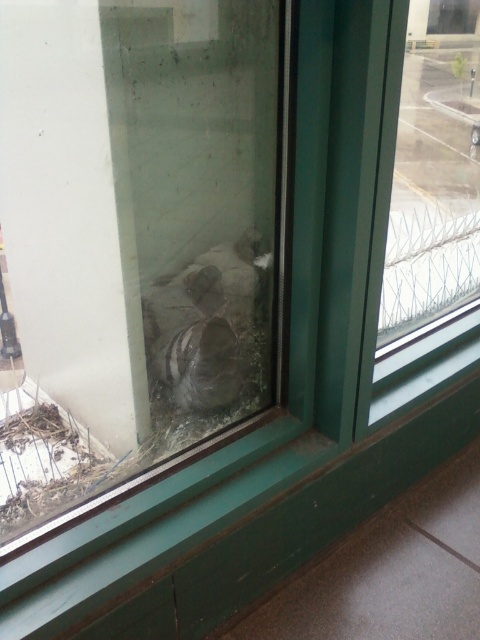
You are standing inside a room and see the window with a green frame. There is a point at coordinates (135, 241) on the window. What object is located at that point?

The transparent glass door at center is located at point (135, 241).

You are standing inside a room and see the transparent glass window at center and the shiny metallic bird at center. Which object is closer to your right side?

The transparent glass window at center is to the right of the shiny metallic bird at center, so the transparent glass window at center is closer to your right side.